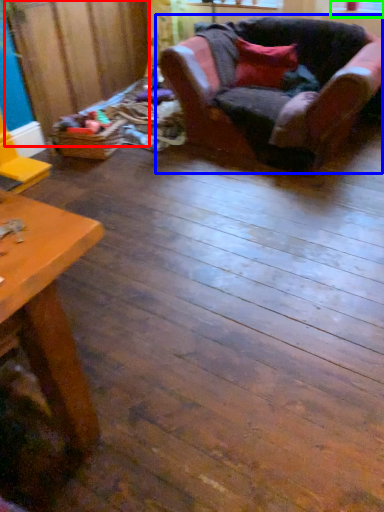
Question: Estimate the real-world distances between objects in this image. Which object is closer to plywood (highlighted by a red box), chair (highlighted by a blue box) or window screen (highlighted by a green box)?

Choices:
 (A) chair
 (B) window screen

Answer: (A)